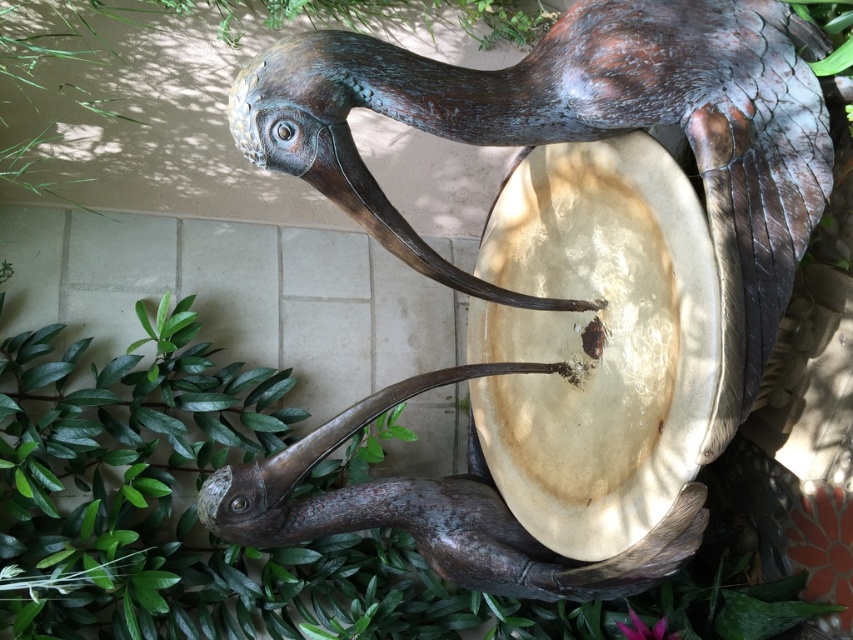
You are standing in a garden and see the bronze textured bird at center and the green leafy plant at lower left. Which object is positioned to the right of the other?

The bronze textured bird at center is to the right of green leafy plant at lower left.

You are a maintenance worker standing 1.5 meters away from the bronze textured bird at center. You need to clean the bird sculpture without moving it. Can you reach it with a 1.2 meter long pole?

The bronze textured bird at center is 1.44 meters away from the viewer. Since you are standing 1.5 meters away, the pole which is 1.2 meters long would not be sufficient to reach it. You need a longer pole.

You are standing at the center of the tiled patio and see two points marked on the ground. The first point is labeled as point (428, 116) and the second is point (230, 470). Which point is closer to you?

Point (428, 116) is in front of point (230, 470), so it is closer to you.